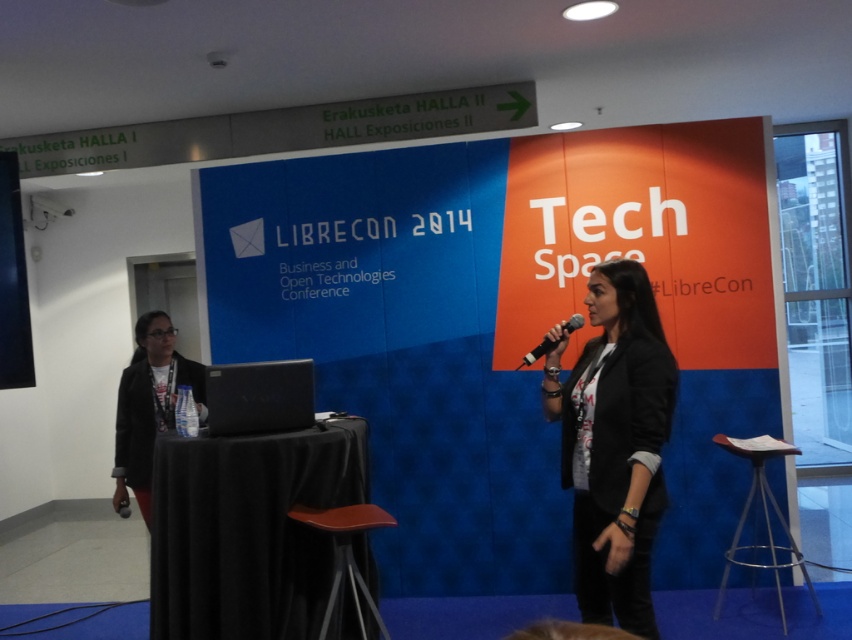
You are organizing a small event and need to place a rectangular table that is 1.2 meters wide between the matte black jacket at left and the wooden stool at center. Based on their widths, will the table fit between them?

The matte black jacket at left is wider than the wooden stool at center. Since the table is 1.2 meters wide, and the space between them depends on their widths, it is possible the table may not fit if the total available space is less than 1.2 meters. However, without exact distance measurements, we cannot confirm for certain.

You are standing in the conference room and need to locate the matte black jacket at left. According to the scene description, where would you find it?

The matte black jacket at left is located at the 2D coordinates point (148, 404) in the scene.